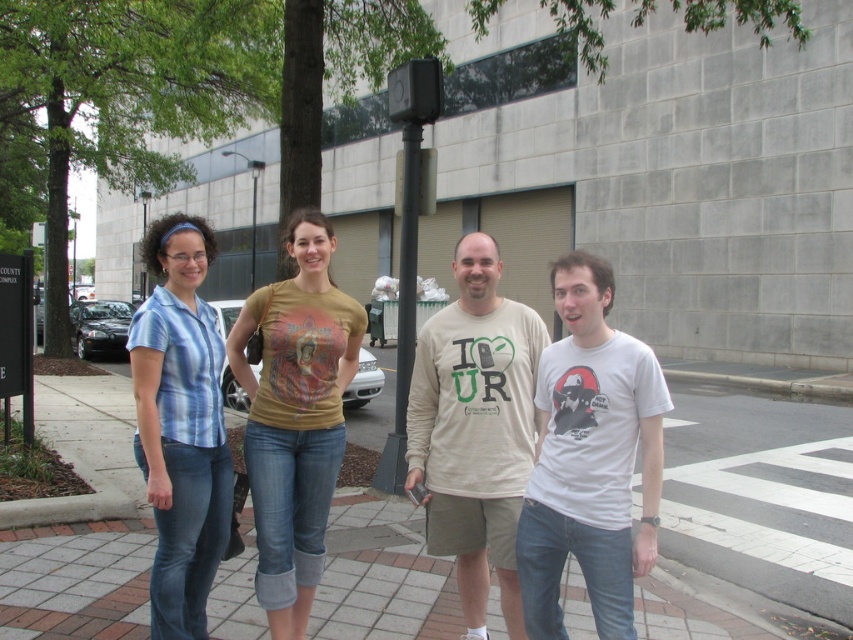
Which of these two, brick pavement at center or beige cotton shirt at center, stands taller?

With more height is beige cotton shirt at center.

Is point (361, 432) farther from viewer compared to point (502, 612)?

Yes, it is.

Identify the location of brick pavement at center. (752, 520).

Is brick pavement at lower center positioned behind white cotton t-shirt at center?

Yes.

Can you confirm if brick pavement at lower center is taller than white cotton t-shirt at center?

No.

Locate an element on the screen. The image size is (853, 640). brick pavement at lower center is located at coordinates (74, 580).

Is point (25, 554) closer to camera compared to point (320, 262)?

No, it is behind (320, 262).

Who is more forward, (575, 608) or (285, 520)?

Positioned in front is point (285, 520).

Image resolution: width=853 pixels, height=640 pixels. Find the location of `brick pavement at lower center`. brick pavement at lower center is located at coordinates pos(74,580).